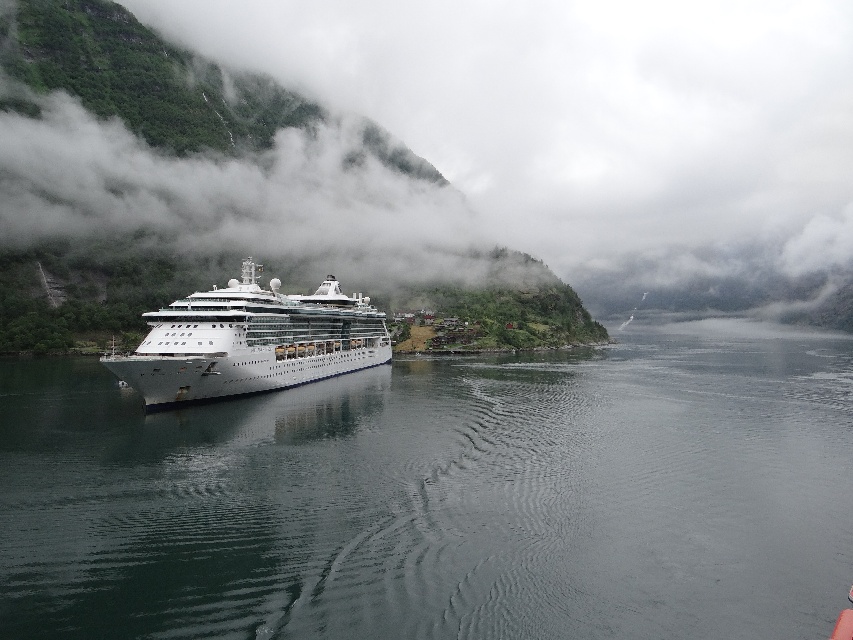
Question: Is clear water at center bigger than green matte mountain at left?

Choices:
 (A) no
 (B) yes

Answer: (A)

Question: Which point is closer to the camera?

Choices:
 (A) (270, 388)
 (B) (415, 609)

Answer: (B)

Question: Which of these objects is positioned farthest from the clear water at center?

Choices:
 (A) green matte mountain at left
 (B) white glossy cruise ship at center

Answer: (A)

Question: Can you confirm if green matte mountain at left is wider than white glossy cruise ship at center?

Choices:
 (A) yes
 (B) no

Answer: (A)

Question: Based on their relative distances, which object is nearer to the green matte mountain at left?

Choices:
 (A) white glossy cruise ship at center
 (B) clear water at center

Answer: (A)

Question: Is clear water at center closer to the viewer compared to green matte mountain at left?

Choices:
 (A) no
 (B) yes

Answer: (B)